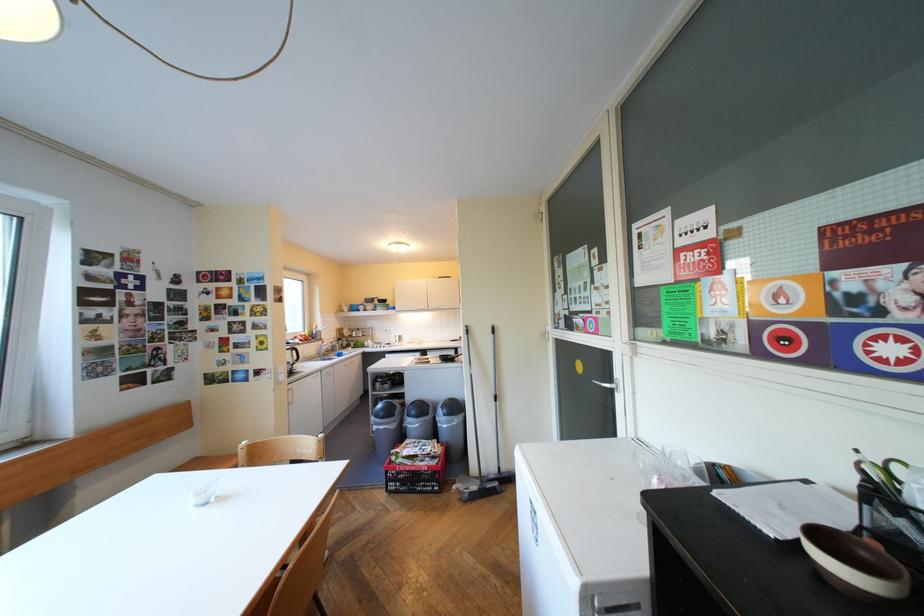
Locate an element on the screen. Image resolution: width=924 pixels, height=616 pixels. silver door handle is located at coordinates (609, 385).